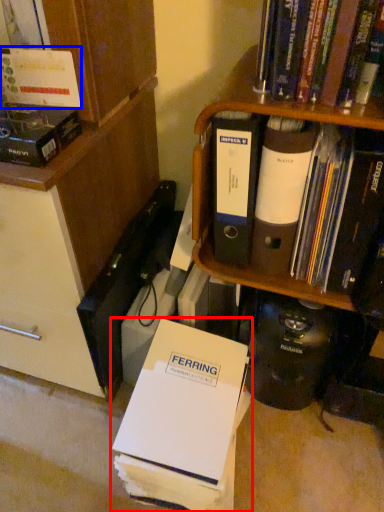
Question: Among these objects, which one is nearest to the camera, book (highlighted by a red box) or book (highlighted by a blue box)?

Choices:
 (A) book
 (B) book

Answer: (B)